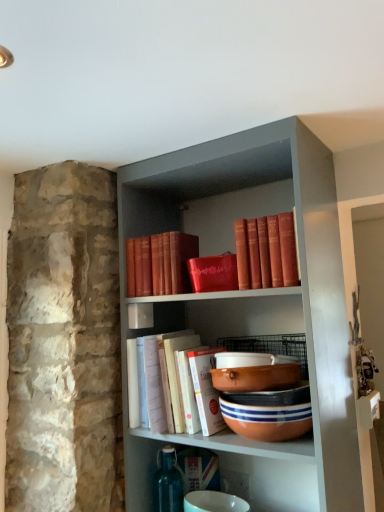
Identify the location of terracotta clay bowl at center, positioned as the 3th bowl in top-to-bottom order. (267, 420).

Image resolution: width=384 pixels, height=512 pixels. What do you see at coordinates (271, 396) in the screenshot?
I see `terracotta clay bowl at center, arranged as the second bowl when ordered from the bottom` at bounding box center [271, 396].

Identify the location of white paper book at center, marked as the 1th book in a bottom-to-top arrangement. This screenshot has height=512, width=384. (157, 381).

This screenshot has height=512, width=384. Find the location of `matte orange bowl at center, which is counted as the 3th bowl, starting from the bottom`. matte orange bowl at center, which is counted as the 3th bowl, starting from the bottom is located at coordinates (256, 378).

From the image's perspective, would you say red leather book at upper center, arranged as the 1th book when viewed from the top, is shown under terracotta clay bowl at center, the 1th bowl when ordered from bottom to top?

Actually, red leather book at upper center, arranged as the 1th book when viewed from the top, appears above terracotta clay bowl at center, the 1th bowl when ordered from bottom to top, in the image.

In terms of height, does red leather book at upper center, marked as the 3th book in a bottom-to-top arrangement, look taller or shorter compared to terracotta clay bowl at center, the 1th bowl when ordered from bottom to top?

In the image, red leather book at upper center, marked as the 3th book in a bottom-to-top arrangement, appears to be taller than terracotta clay bowl at center, the 1th bowl when ordered from bottom to top.

From a real-world perspective, does red leather book at upper center, arranged as the 1th book when viewed from the top, sit lower than terracotta clay bowl at center, the 1th bowl when ordered from bottom to top?

No.

At what (x,y) coordinates should I click in order to perform the action: click on the 3rd bowl located beneath the red leather book at upper center, marked as the 3th book in a bottom-to-top arrangement (from a real-world perspective). Please return your answer as a coordinate pair (x, y). This screenshot has width=384, height=512. Looking at the image, I should click on (267, 420).

Considering the positions of objects terracotta clay bowl at center, arranged as the second bowl when ordered from the bottom, and matte orange bowl at center, which is the first bowl from top to bottom, in the image provided, who is behind, terracotta clay bowl at center, arranged as the second bowl when ordered from the bottom, or matte orange bowl at center, which is the first bowl from top to bottom,?

terracotta clay bowl at center, arranged as the second bowl when ordered from the bottom.

Is matte orange bowl at center, which is counted as the 3th bowl, starting from the bottom, a part of terracotta clay bowl at center, which is the 2th bowl in top-to-bottom order?

No, matte orange bowl at center, which is counted as the 3th bowl, starting from the bottom, is not a part of terracotta clay bowl at center, which is the 2th bowl in top-to-bottom order.

From the picture: From a real-world perspective, which is physically above, terracotta clay bowl at center, which is the 2th bowl in top-to-bottom order, or matte orange bowl at center, which is counted as the 3th bowl, starting from the bottom?

matte orange bowl at center, which is counted as the 3th bowl, starting from the bottom.

Can you confirm if terracotta clay bowl at center, arranged as the second bowl when ordered from the bottom, is positioned to the left of matte orange bowl at center, which is counted as the 3th bowl, starting from the bottom?

No, terracotta clay bowl at center, arranged as the second bowl when ordered from the bottom, is not to the left of matte orange bowl at center, which is counted as the 3th bowl, starting from the bottom.

Does point (242, 370) lie in front of point (287, 426)?

No, it is behind (287, 426).

Which of these two, matte orange bowl at center, which is the first bowl from top to bottom, or terracotta clay bowl at center, positioned as the 3th bowl in top-to-bottom order, is bigger?

terracotta clay bowl at center, positioned as the 3th bowl in top-to-bottom order.

Could terracotta clay bowl at center, the 1th bowl when ordered from bottom to top, be considered to be inside matte orange bowl at center, which is the first bowl from top to bottom?

No.

Considering the relative sizes of terracotta clay bowl at center, arranged as the second bowl when ordered from the bottom, and terracotta clay bowl at center, positioned as the 3th bowl in top-to-bottom order, in the image provided, is terracotta clay bowl at center, arranged as the second bowl when ordered from the bottom, smaller than terracotta clay bowl at center, positioned as the 3th bowl in top-to-bottom order,?

Indeed, terracotta clay bowl at center, arranged as the second bowl when ordered from the bottom, has a smaller size compared to terracotta clay bowl at center, positioned as the 3th bowl in top-to-bottom order.

Is terracotta clay bowl at center, positioned as the 3th bowl in top-to-bottom order, a part of terracotta clay bowl at center, arranged as the second bowl when ordered from the bottom?

No, terracotta clay bowl at center, arranged as the second bowl when ordered from the bottom, does not contain terracotta clay bowl at center, positioned as the 3th bowl in top-to-bottom order.

Is terracotta clay bowl at center, which is the 2th bowl in top-to-bottom order, far from terracotta clay bowl at center, the 1th bowl when ordered from bottom to top?

No, terracotta clay bowl at center, which is the 2th bowl in top-to-bottom order, is not far from terracotta clay bowl at center, the 1th bowl when ordered from bottom to top.

From the image's perspective, is terracotta clay bowl at center, positioned as the 3th bowl in top-to-bottom order, above matte orange bowl at center, which is the first bowl from top to bottom?

No, from the image's perspective, terracotta clay bowl at center, positioned as the 3th bowl in top-to-bottom order, is not above matte orange bowl at center, which is the first bowl from top to bottom.

Is terracotta clay bowl at center, positioned as the 3th bowl in top-to-bottom order, positioned with its back to matte orange bowl at center, which is the first bowl from top to bottom?

No.

Does terracotta clay bowl at center, positioned as the 3th bowl in top-to-bottom order, have a greater width compared to matte orange bowl at center, which is counted as the 3th bowl, starting from the bottom?

Correct, the width of terracotta clay bowl at center, positioned as the 3th bowl in top-to-bottom order, exceeds that of matte orange bowl at center, which is counted as the 3th bowl, starting from the bottom.

Between terracotta clay bowl at center, which is the 2th bowl in top-to-bottom order, and matte red book at upper center, the second book from the top, which one appears on the right side from the viewer's perspective?

Positioned to the right is terracotta clay bowl at center, which is the 2th bowl in top-to-bottom order.

From the image's perspective, is terracotta clay bowl at center, arranged as the second bowl when ordered from the bottom, over matte red book at upper center, positioned as the 2th book in bottom-to-top order?

Actually, terracotta clay bowl at center, arranged as the second bowl when ordered from the bottom, appears below matte red book at upper center, positioned as the 2th book in bottom-to-top order, in the image.

Considering the positions of points (278, 406) and (175, 278), is point (278, 406) closer to camera compared to point (175, 278)?

Yes.

From a real-world perspective, is terracotta clay bowl at center, which is the 2th bowl in top-to-bottom order, on matte red book at upper center, the second book from the top?

Actually, terracotta clay bowl at center, which is the 2th bowl in top-to-bottom order, is physically below matte red book at upper center, the second book from the top, in the real world.

The image size is (384, 512). Find the location of `bowl above the terracotta clay bowl at center, which is the 2th bowl in top-to-bottom order (from the image's perspective)`. bowl above the terracotta clay bowl at center, which is the 2th bowl in top-to-bottom order (from the image's perspective) is located at coordinates (256, 378).

Considering the sizes of objects matte orange bowl at center, which is counted as the 3th bowl, starting from the bottom, and terracotta clay bowl at center, arranged as the second bowl when ordered from the bottom, in the image provided, who is smaller, matte orange bowl at center, which is counted as the 3th bowl, starting from the bottom, or terracotta clay bowl at center, arranged as the second bowl when ordered from the bottom,?

With smaller size is terracotta clay bowl at center, arranged as the second bowl when ordered from the bottom.

Is terracotta clay bowl at center, arranged as the second bowl when ordered from the bottom, at the back of matte orange bowl at center, which is counted as the 3th bowl, starting from the bottom?

No, matte orange bowl at center, which is counted as the 3th bowl, starting from the bottom, is not facing the opposite direction of terracotta clay bowl at center, arranged as the second bowl when ordered from the bottom.

At what (x,y) coordinates should I click in order to perform the action: click on the 3rd bowl below the red leather book at upper center, marked as the 3th book in a bottom-to-top arrangement (from the image's perspective). Please return your answer as a coordinate pair (x, y). Image resolution: width=384 pixels, height=512 pixels. Looking at the image, I should click on (267, 420).

Find the location of a particular element. Image resolution: width=384 pixels, height=512 pixels. bowl that is on the left side of terracotta clay bowl at center, arranged as the second bowl when ordered from the bottom is located at coordinates (256, 378).

Estimate the real-world distances between objects in this image. Which object is further from terracotta clay bowl at center, positioned as the 3th bowl in top-to-bottom order, white paper book at center, the third book positioned from the top, or terracotta clay bowl at center, arranged as the second bowl when ordered from the bottom?

The object further to terracotta clay bowl at center, positioned as the 3th bowl in top-to-bottom order, is white paper book at center, the third book positioned from the top.

When comparing their distances from terracotta clay bowl at center, which is the 2th bowl in top-to-bottom order, does white paper book at center, the third book positioned from the top, or terracotta clay bowl at center, the 1th bowl when ordered from bottom to top, seem closer?

terracotta clay bowl at center, the 1th bowl when ordered from bottom to top, lies closer to terracotta clay bowl at center, which is the 2th bowl in top-to-bottom order, than the other object.

When comparing their distances from terracotta clay bowl at center, positioned as the 3th bowl in top-to-bottom order, does matte red book at upper center, positioned as the 2th book in bottom-to-top order, or matte orange bowl at center, which is the first bowl from top to bottom, seem further?

matte red book at upper center, positioned as the 2th book in bottom-to-top order, is positioned further to the anchor terracotta clay bowl at center, positioned as the 3th bowl in top-to-bottom order.

Based on their spatial positions, is terracotta clay bowl at center, positioned as the 3th bowl in top-to-bottom order, or matte red book at upper center, positioned as the 2th book in bottom-to-top order, further from white paper book at center, marked as the 1th book in a bottom-to-top arrangement?

terracotta clay bowl at center, positioned as the 3th bowl in top-to-bottom order, lies further to white paper book at center, marked as the 1th book in a bottom-to-top arrangement, than the other object.

Looking at the image, which one is located closer to matte orange bowl at center, which is the first bowl from top to bottom, terracotta clay bowl at center, arranged as the second bowl when ordered from the bottom, or red leather book at upper center, marked as the 3th book in a bottom-to-top arrangement?

terracotta clay bowl at center, arranged as the second bowl when ordered from the bottom, lies closer to matte orange bowl at center, which is the first bowl from top to bottom, than the other object.

Based on their spatial positions, is red leather book at upper center, marked as the 3th book in a bottom-to-top arrangement, or matte orange bowl at center, which is the first bowl from top to bottom, further from terracotta clay bowl at center, arranged as the second bowl when ordered from the bottom?

red leather book at upper center, marked as the 3th book in a bottom-to-top arrangement.

In the scene shown: Based on their spatial positions, is white paper book at center, marked as the 1th book in a bottom-to-top arrangement, or terracotta clay bowl at center, the 1th bowl when ordered from bottom to top, further from red leather book at upper center, arranged as the 1th book when viewed from the top?

Based on the image, white paper book at center, marked as the 1th book in a bottom-to-top arrangement, appears to be further to red leather book at upper center, arranged as the 1th book when viewed from the top.

Considering their positions, is matte orange bowl at center, which is the first bowl from top to bottom, positioned further to red leather book at upper center, marked as the 3th book in a bottom-to-top arrangement, than white paper book at center, marked as the 1th book in a bottom-to-top arrangement?

white paper book at center, marked as the 1th book in a bottom-to-top arrangement.

Where is `book between red leather book at upper center, arranged as the 1th book when viewed from the top, and white paper book at center, the third book positioned from the top, in the vertical direction`? This screenshot has height=512, width=384. book between red leather book at upper center, arranged as the 1th book when viewed from the top, and white paper book at center, the third book positioned from the top, in the vertical direction is located at coordinates (160, 264).

I want to click on book between red leather book at upper center, marked as the 3th book in a bottom-to-top arrangement, and terracotta clay bowl at center, arranged as the second bowl when ordered from the bottom, in the up-down direction, so click(160, 264).

Find the location of a particular element. bowl between matte orange bowl at center, which is counted as the 3th bowl, starting from the bottom, and terracotta clay bowl at center, the 1th bowl when ordered from bottom to top, in the up-down direction is located at coordinates (271, 396).

Find the location of `bowl between red leather book at upper center, arranged as the 1th book when viewed from the top, and terracotta clay bowl at center, arranged as the second bowl when ordered from the bottom, vertically`. bowl between red leather book at upper center, arranged as the 1th book when viewed from the top, and terracotta clay bowl at center, arranged as the second bowl when ordered from the bottom, vertically is located at coordinates (256, 378).